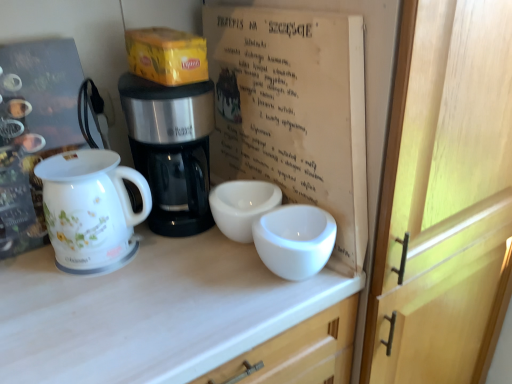
Question: Could you tell me if yellow cardboard box at upper center is turned towards black plastic coffee maker at center?

Choices:
 (A) yes
 (B) no

Answer: (B)

Question: Considering the relative sizes of yellow cardboard box at upper center and black plastic coffee maker at center in the image provided, is yellow cardboard box at upper center shorter than black plastic coffee maker at center?

Choices:
 (A) no
 (B) yes

Answer: (B)

Question: From a real-world perspective, does yellow cardboard box at upper center stand above black plastic coffee maker at center?

Choices:
 (A) no
 (B) yes

Answer: (B)

Question: Are yellow cardboard box at upper center and black plastic coffee maker at center far apart?

Choices:
 (A) no
 (B) yes

Answer: (A)

Question: Is black plastic coffee maker at center at the back of yellow cardboard box at upper center?

Choices:
 (A) yes
 (B) no

Answer: (B)

Question: Is white glossy jug at left taller or shorter than yellow cardboard box at upper center?

Choices:
 (A) short
 (B) tall

Answer: (B)

Question: From a real-world perspective, relative to yellow cardboard box at upper center, is white glossy jug at left vertically above or below?

Choices:
 (A) below
 (B) above

Answer: (A)

Question: In the image, is white glossy jug at left positioned in front of or behind yellow cardboard box at upper center?

Choices:
 (A) front
 (B) behind

Answer: (A)

Question: From the image's perspective, relative to yellow cardboard box at upper center, is white glossy jug at left above or below?

Choices:
 (A) above
 (B) below

Answer: (B)

Question: Considering their positions, is white paper at center located in front of or behind black plastic coffee maker at center?

Choices:
 (A) front
 (B) behind

Answer: (A)

Question: From a real-world perspective, is white paper at center positioned above or below black plastic coffee maker at center?

Choices:
 (A) below
 (B) above

Answer: (B)

Question: Does point (300, 56) appear closer or farther from the camera than point (157, 180)?

Choices:
 (A) farther
 (B) closer

Answer: (B)

Question: In terms of height, does white paper at center look taller or shorter compared to black plastic coffee maker at center?

Choices:
 (A) short
 (B) tall

Answer: (B)

Question: Looking at the image, does yellow cardboard box at upper center seem bigger or smaller compared to white paper at center?

Choices:
 (A) big
 (B) small

Answer: (B)

Question: From the image's perspective, is yellow cardboard box at upper center located above or below white paper at center?

Choices:
 (A) above
 (B) below

Answer: (A)